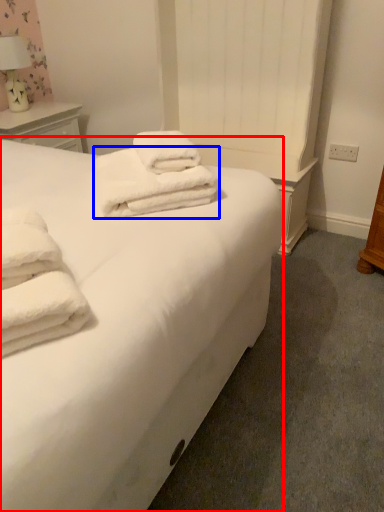
Question: Which object appears farthest to the camera in this image, bed (highlighted by a red box) or towel (highlighted by a blue box)?

Choices:
 (A) bed
 (B) towel

Answer: (B)